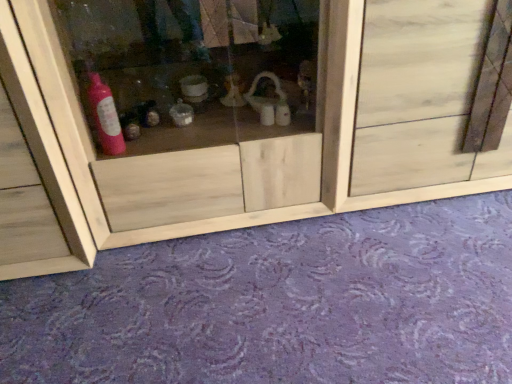
Question: Considering the relative positions of purple carpet at lower center and natural wood door at center in the image provided, is purple carpet at lower center to the left or to the right of natural wood door at center?

Choices:
 (A) left
 (B) right

Answer: (A)

Question: Relative to natural wood door at center, is purple carpet at lower center in front or behind?

Choices:
 (A) behind
 (B) front

Answer: (B)

Question: Which object is positioned closest to the purple carpet at lower center?

Choices:
 (A) transparent wood cabinet at center
 (B) natural wood door at center

Answer: (A)

Question: Based on their relative distances, which object is nearer to the transparent wood cabinet at center?

Choices:
 (A) natural wood door at center
 (B) purple carpet at lower center

Answer: (A)